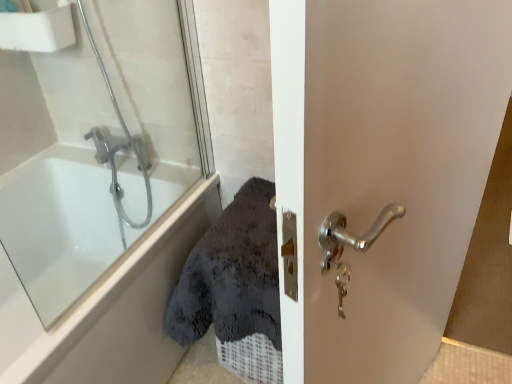
This screenshot has width=512, height=384. In order to click on white glossy bathtub at left in this screenshot , I will do `click(59, 226)`.

What do you see at coordinates (59, 226) in the screenshot? This screenshot has width=512, height=384. I see `white glossy bathtub at left` at bounding box center [59, 226].

Find the location of `white glossy bathtub at left`. white glossy bathtub at left is located at coordinates pos(59,226).